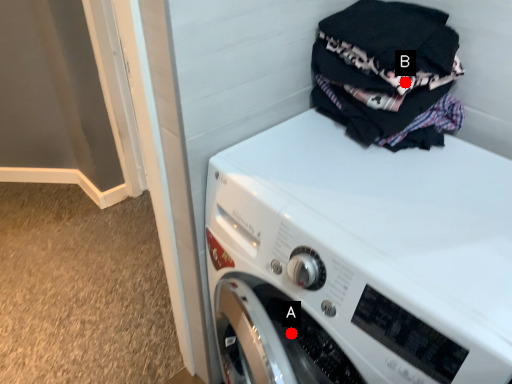
Question: Two points are circled on the image, labeled by A and B beside each circle. Which of the following is the closest to the observer?

Choices:
 (A) A is closer
 (B) B is closer

Answer: (B)